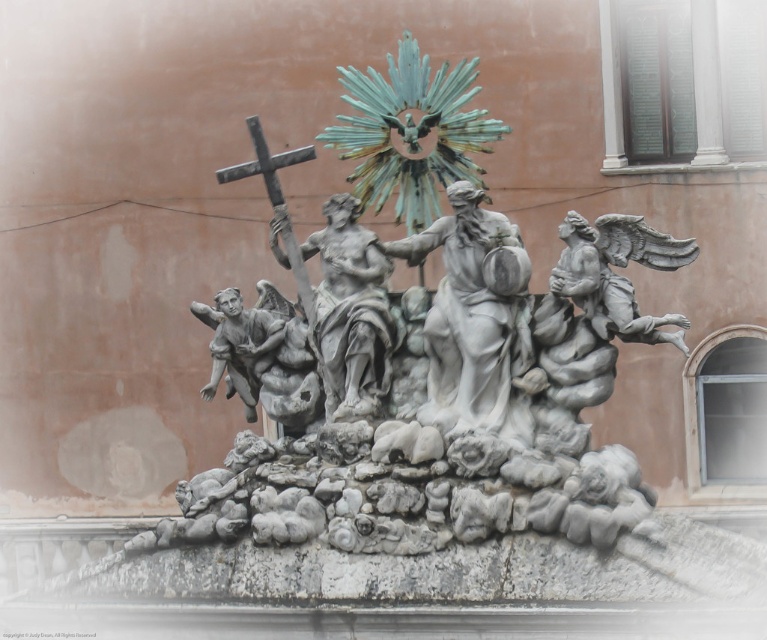
Looking at this image, who is higher up, polished bronze statue at center or metallic cross at upper left?

metallic cross at upper left is above.

How far apart are polished bronze statue at center and metallic cross at upper left?

The distance of polished bronze statue at center from metallic cross at upper left is 10.98 feet.

Does point (351, 396) come closer to viewer compared to point (247, 128)?

Yes, point (351, 396) is in front of point (247, 128).

What are the coordinates of `polished bronze statue at center` in the screenshot? It's located at (351, 312).